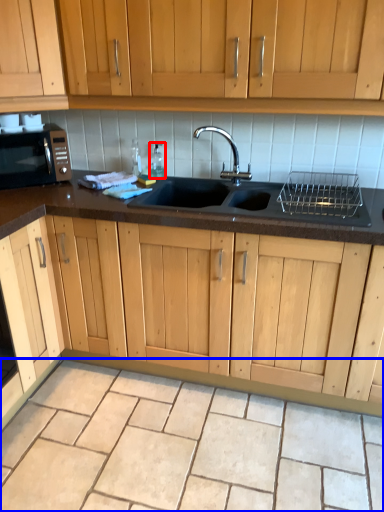
Question: Which object is closer to the camera taking this photo, bottle (highlighted by a red box) or granite (highlighted by a blue box)?

Choices:
 (A) bottle
 (B) granite

Answer: (B)